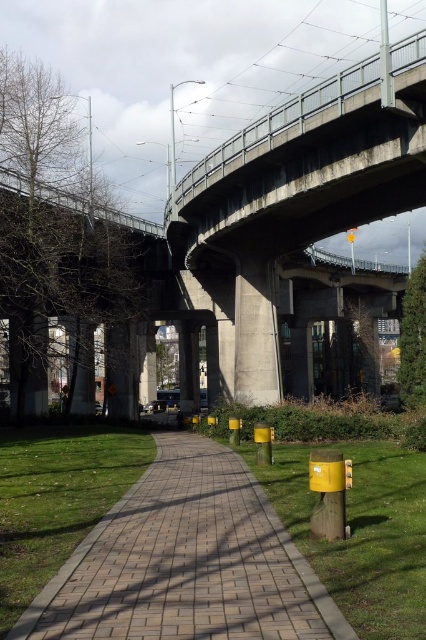
You are a delivery person carrying a heavy box and need to walk from the brick paved walkway at center to the metallic gray pole at upper right. Which object will you encounter first?

You will encounter the brick paved walkway at center first because it is closer to the viewer than the metallic gray pole at upper right.

You are standing at the point marked as point (186, 561) in the image. What surface are you standing on?

The point (186, 561) indicates brick paved walkway at center, so you are standing on the brick paved walkway at center.

You are standing at the origin point of the scene. Which direction should you move to reach the brick paved walkway at center?

The brick paved walkway at center is located at point (186, 561), so you should move towards the coordinates provided to reach it.